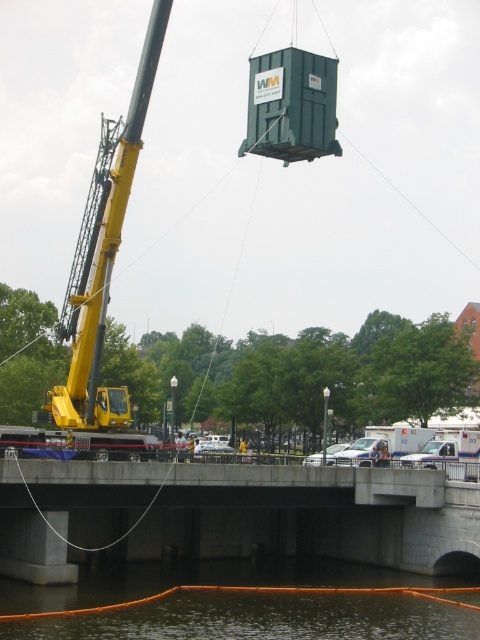
Which is behind, point (4, 481) or point (437, 586)?

Point (437, 586)

Is concrete bridge at center below brown murky water at lower center?

Incorrect, concrete bridge at center is not positioned below brown murky water at lower center.

Find the location of a particular element. The image size is (480, 640). concrete bridge at center is located at coordinates (235, 515).

Find the location of `concrete bridge at center`. concrete bridge at center is located at coordinates (235, 515).

Is concrete bridge at center below yellow metallic crane at left?

Yes.

Does concrete bridge at center come in front of yellow metallic crane at left?

A: Yes.

Between point (55, 550) and point (116, 230), which one is positioned in front?

Point (55, 550) is more forward.

The image size is (480, 640). I want to click on concrete bridge at center, so click(x=235, y=515).

From the picture: Between brown murky water at lower center and yellow metallic crane at left, which one is positioned higher?

yellow metallic crane at left

Between point (289, 595) and point (103, 225), which one is positioned in front?

Point (289, 595) is more forward.

Which is behind, point (342, 573) or point (86, 337)?

The point (342, 573) is behind.

The height and width of the screenshot is (640, 480). I want to click on brown murky water at lower center, so click(262, 618).